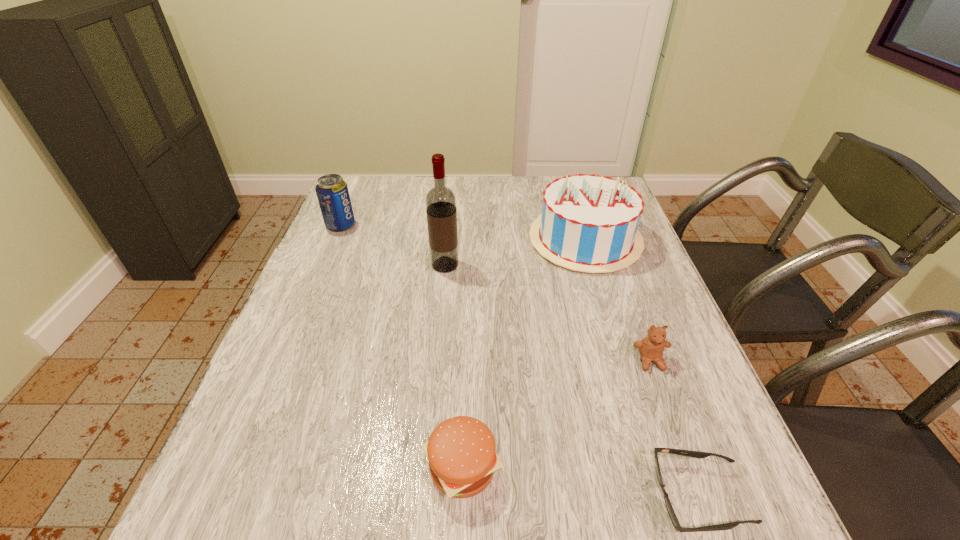
Locate an element on the screen. teddy bear positioned at the right edge is located at coordinates (651, 348).

Find the location of `sunglasses at the right edge`. sunglasses at the right edge is located at coordinates (696, 454).

This screenshot has width=960, height=540. Find the location of `object located at the far right corner`. object located at the far right corner is located at coordinates (589, 223).

Locate an element on the screen. Image resolution: width=960 pixels, height=540 pixels. object present at the near right corner is located at coordinates (696, 454).

You are a GUI agent. You are given a task and a screenshot of the screen. Output one action in this format:
    pyautogui.click(x=<x>, y=<y>)
    Task: Click on the free space at the far edge
    The width and height of the screenshot is (960, 540).
    Given the screenshot: What is the action you would take?
    pyautogui.click(x=455, y=194)

The height and width of the screenshot is (540, 960). I want to click on vacant area at the left edge of the desktop, so click(x=340, y=246).

In order to click on vacant space at the right edge of the desktop in this screenshot , I will do `click(682, 387)`.

In the image, there is a desktop. In order to click on free region at the near left corner in this screenshot , I will do `click(253, 503)`.

I want to click on vacant space at the near right corner, so click(755, 503).

You are a GUI agent. You are given a task and a screenshot of the screen. Output one action in this format:
    pyautogui.click(x=<x>, y=<y>)
    Task: Click on the empty space between the second tallest object and the fourth farthest object
    The width and height of the screenshot is (960, 540).
    Given the screenshot: What is the action you would take?
    pyautogui.click(x=617, y=300)